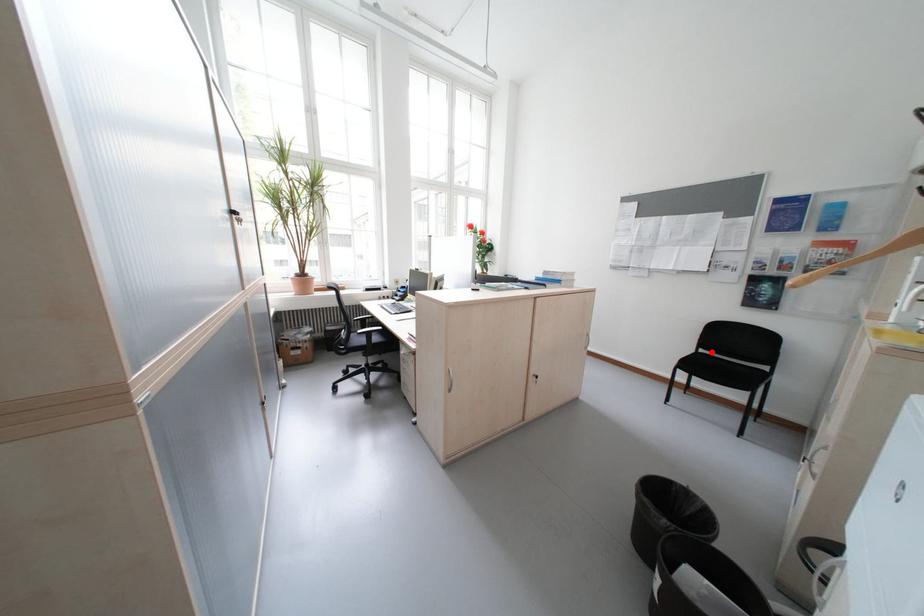
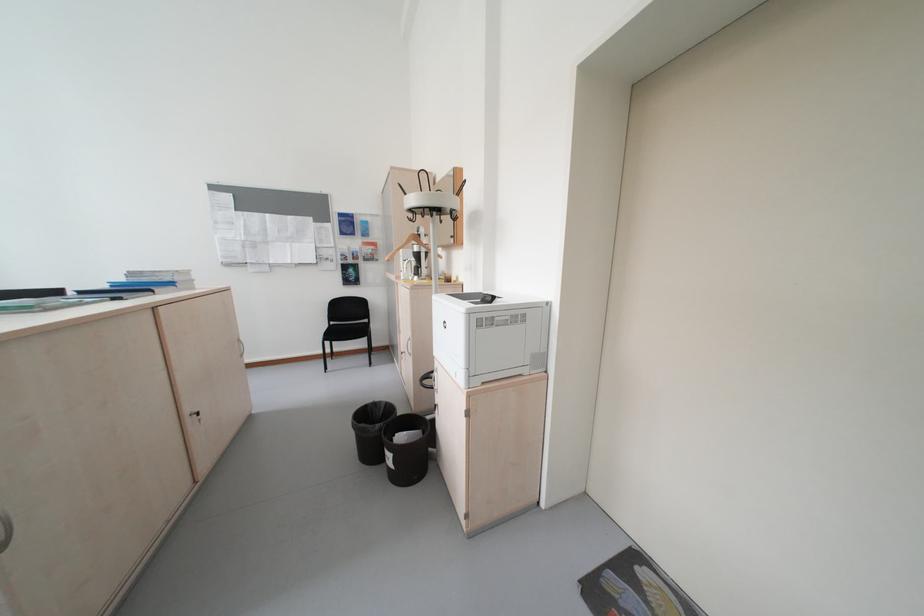
The point at the highlighted location is marked in the first image. Where is the corresponding point in the second image?

(343, 323)